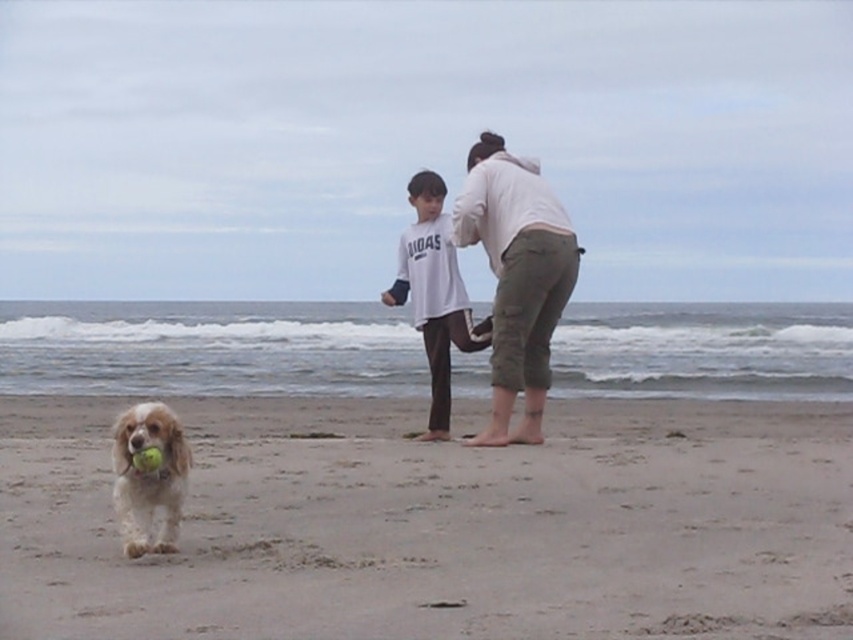
Question: Estimate the real-world distances between objects in this image. Which object is farther from the golden fur dog at lower left?

Choices:
 (A) smooth beige sand at center
 (B) white cotton shirt at center
 (C) white cotton hoodie at center

Answer: (A)

Question: Does smooth beige sand at center have a greater width compared to white cotton hoodie at center?

Choices:
 (A) yes
 (B) no

Answer: (A)

Question: Is smooth beige sand at center to the left of white cotton shirt at center from the viewer's perspective?

Choices:
 (A) yes
 (B) no

Answer: (B)

Question: Which of the following is the closest to the observer?

Choices:
 (A) (260, 563)
 (B) (527, 403)

Answer: (A)

Question: Which object is closer to the camera taking this photo?

Choices:
 (A) white cotton shirt at center
 (B) smooth beige sand at center

Answer: (B)

Question: Does smooth beige sand at center have a smaller size compared to white cotton shirt at center?

Choices:
 (A) no
 (B) yes

Answer: (A)